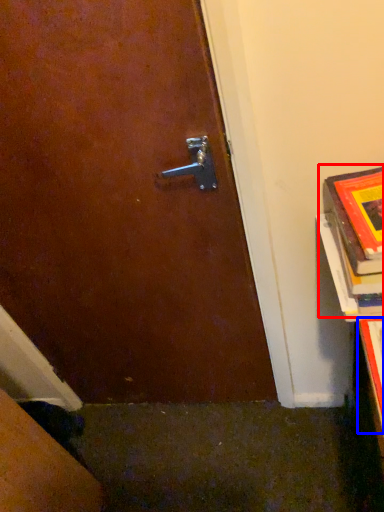
Question: Among these objects, which one is nearest to the camera, book (highlighted by a red box) or book cover (highlighted by a blue box)?

Choices:
 (A) book
 (B) book cover

Answer: (B)